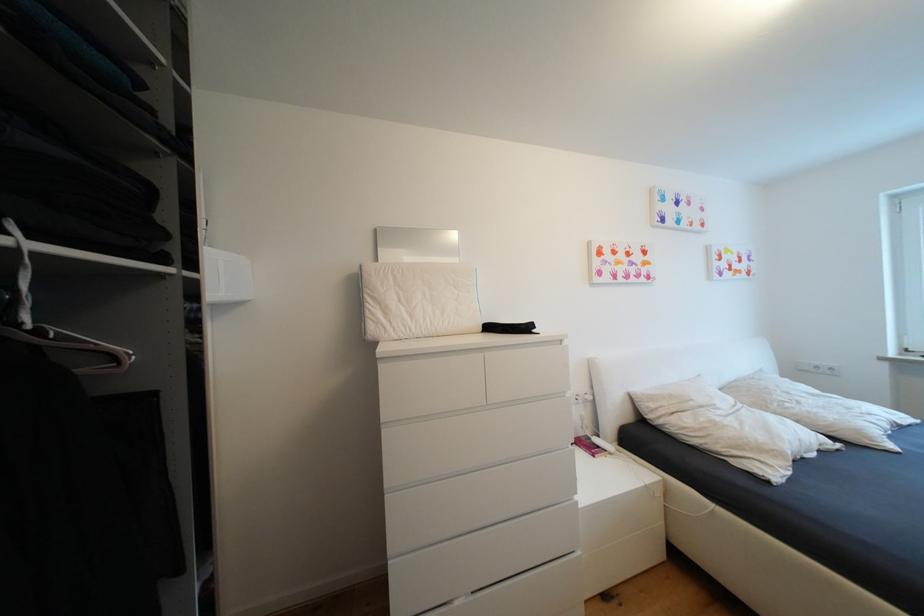
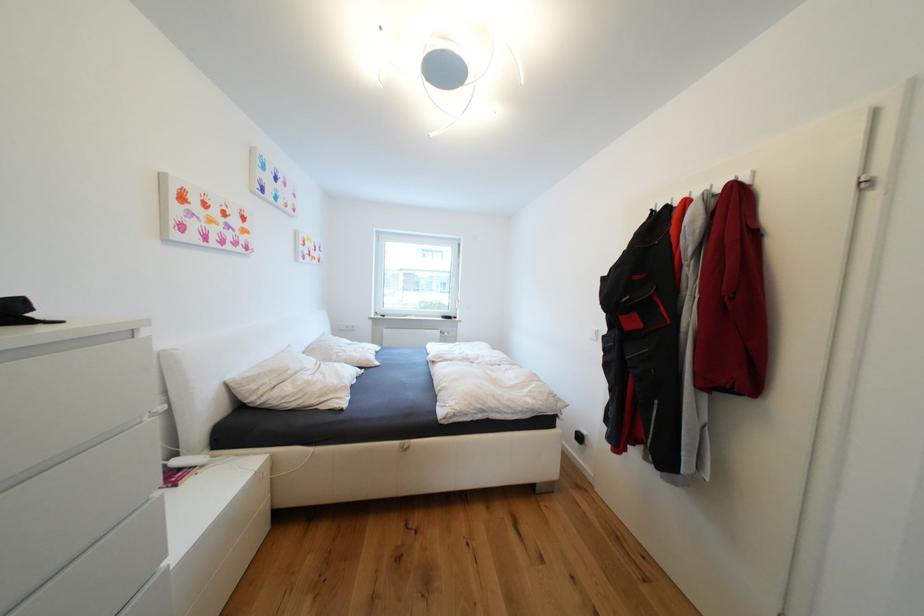
Locate, in the second image, the point that corresponds to [709,408] in the first image.

(304, 374)